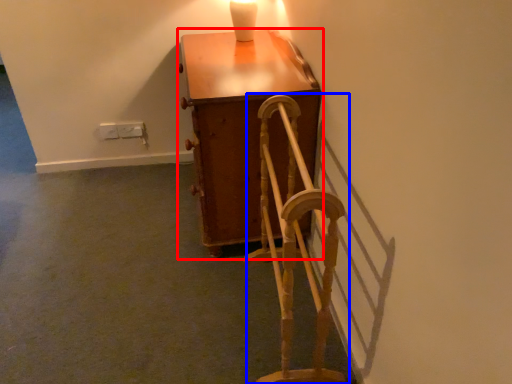
Question: Which object appears farthest to the camera in this image, furniture (highlighted by a red box) or rocking chair (highlighted by a blue box)?

Choices:
 (A) furniture
 (B) rocking chair

Answer: (A)